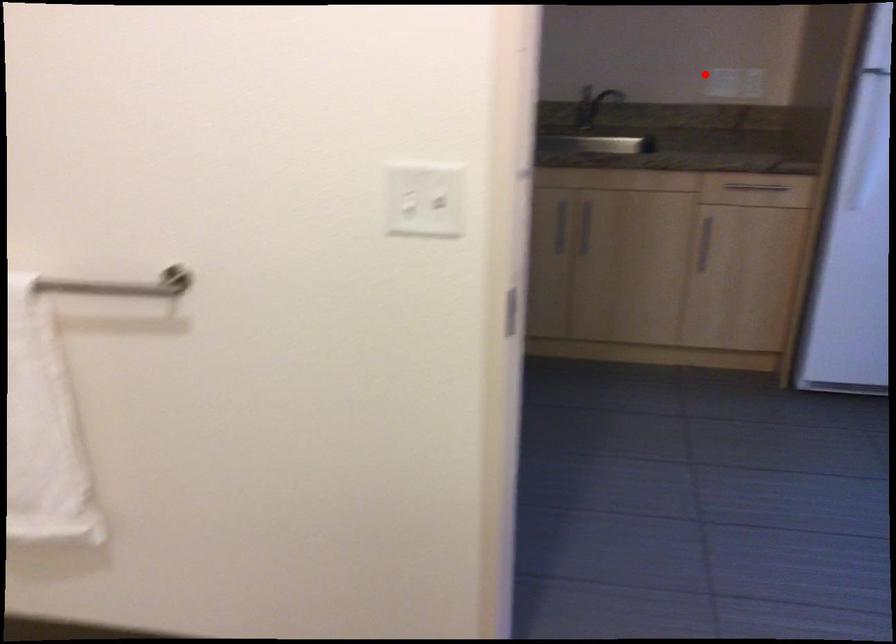
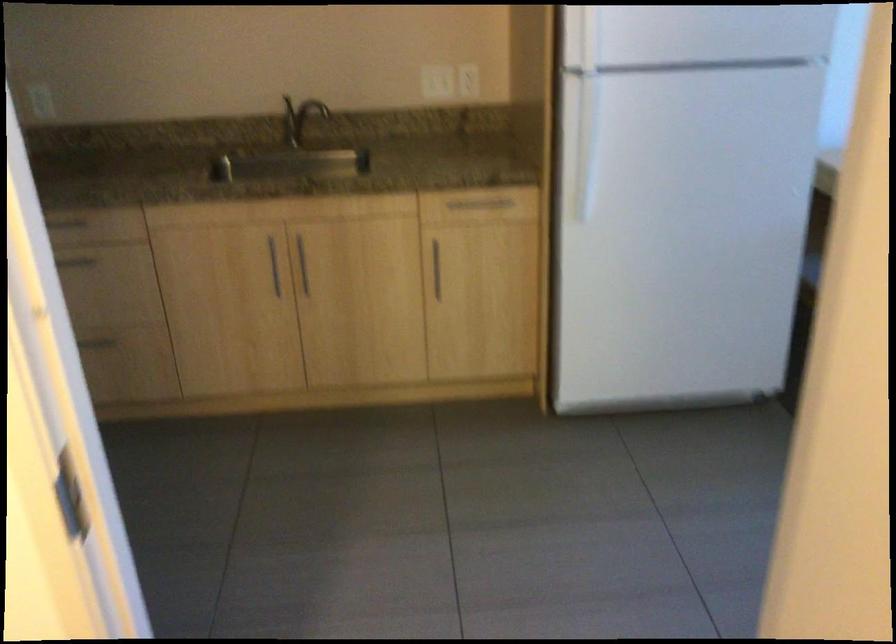
Question: I am providing you with two images of the same scene from different viewpoints. Given a red point in image1, look at the same physical point in image2. Is it:

Choices:
 (A) Closer to the viewpoint
 (B) Farther from the viewpoint

Answer: (A)